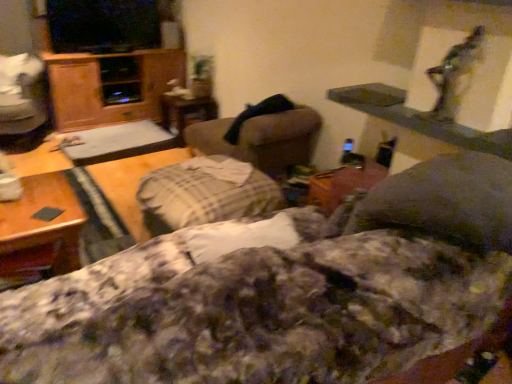
Question: From the image's perspective, is plush beige swivel chair at center, the second swivel chair positioned from the left, over wooden table at upper right, which is the fourth table from left to right?

Choices:
 (A) yes
 (B) no

Answer: (A)

Question: Is plush beige swivel chair at center, the 2th swivel chair in the back-to-front sequence, wider than wooden table at upper right, which is the 1th table from right to left?

Choices:
 (A) yes
 (B) no

Answer: (A)

Question: Can you confirm if plush beige swivel chair at center, the 2th swivel chair in the back-to-front sequence, is thinner than wooden table at upper right, acting as the 1th table starting from the front?

Choices:
 (A) yes
 (B) no

Answer: (B)

Question: Is plush beige swivel chair at center, acting as the first swivel chair starting from the front, shorter than wooden table at upper right, which is the fourth table from back to front?

Choices:
 (A) no
 (B) yes

Answer: (A)

Question: Is there a large distance between plush beige swivel chair at center, acting as the first swivel chair starting from the front, and wooden table at upper right, acting as the 1th table starting from the front?

Choices:
 (A) no
 (B) yes

Answer: (A)

Question: Is plush beige swivel chair at center, acting as the first swivel chair starting from the front, bigger than wooden table at upper right, acting as the 1th table starting from the front?

Choices:
 (A) no
 (B) yes

Answer: (B)

Question: Considering the relative positions of brown wooden table at lower left, the 3th table when ordered from right to left, and fluffy cotton blanket at center in the image provided, is brown wooden table at lower left, the 3th table when ordered from right to left, to the left of fluffy cotton blanket at center from the viewer's perspective?

Choices:
 (A) no
 (B) yes

Answer: (B)

Question: Does brown wooden table at lower left, placed as the second table when sorted from left to right, have a lesser height compared to fluffy cotton blanket at center?

Choices:
 (A) no
 (B) yes

Answer: (B)

Question: From the image's perspective, is brown wooden table at lower left, positioned as the 2th table in front-to-back order, over fluffy cotton blanket at center?

Choices:
 (A) yes
 (B) no

Answer: (A)

Question: Is fluffy cotton blanket at center completely or partially inside brown wooden table at lower left, positioned as the 2th table in front-to-back order?

Choices:
 (A) yes
 (B) no

Answer: (B)

Question: Is brown wooden table at lower left, the 3th table when ordered from right to left, far away from fluffy cotton blanket at center?

Choices:
 (A) no
 (B) yes

Answer: (B)

Question: Can we say brown wooden table at lower left, which ranks as the 3th table in back-to-front order, lies outside fluffy cotton blanket at center?

Choices:
 (A) no
 (B) yes

Answer: (B)

Question: Is fluffy cotton blanket at center located within plush beige swivel chair at center, the second swivel chair positioned from the left?

Choices:
 (A) no
 (B) yes

Answer: (A)